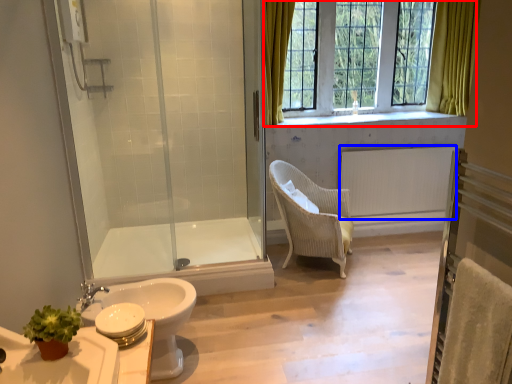
Question: Among these objects, which one is nearest to the camera, window (highlighted by a red box) or radiator (highlighted by a blue box)?

Choices:
 (A) window
 (B) radiator

Answer: (A)